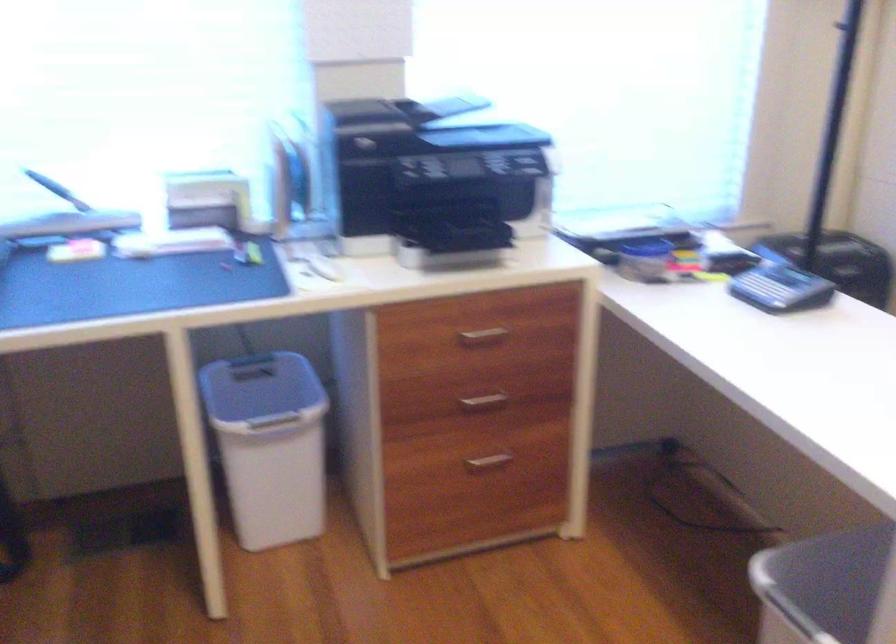
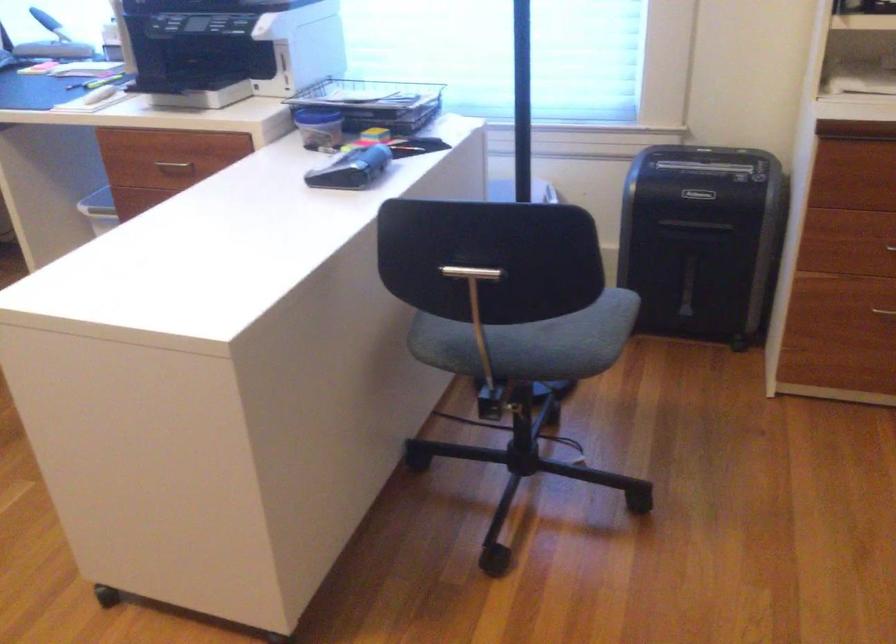
Question: I am providing you with two images of the same scene from different viewpoints. Which of the following objects are not visible in image2?

Choices:
 (A) chair sitting surface
 (B) white electrical plug
 (C) silver drawer handle
 (D) metal drawer handle

Answer: (C)